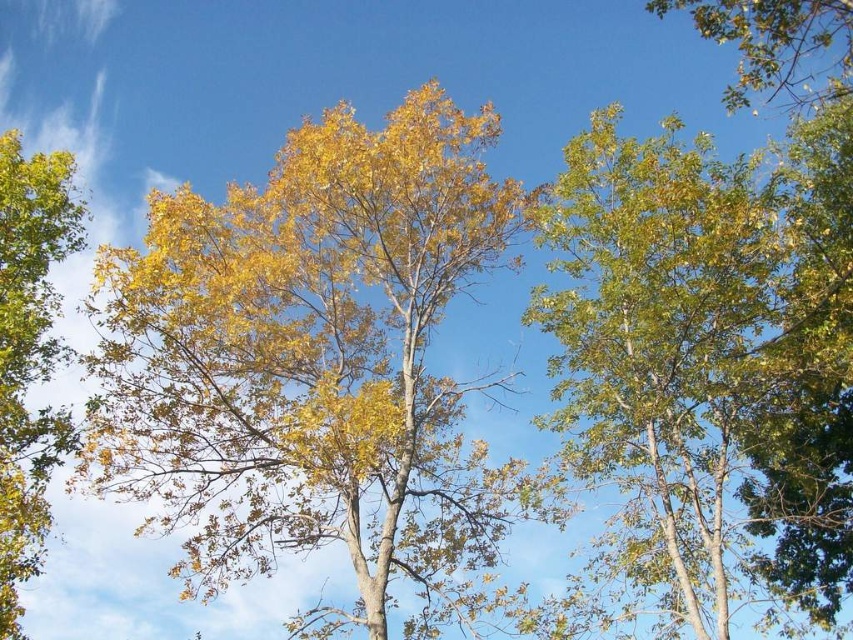
Question: Which point appears farthest from the camera in this image?

Choices:
 (A) (219, 269)
 (B) (671, 316)

Answer: (A)

Question: Does yellow-green leaves at center appear under green matte tree at left?

Choices:
 (A) yes
 (B) no

Answer: (A)

Question: Which is farther from the green matte tree at upper right?

Choices:
 (A) yellow-green leaves at center
 (B) green matte tree at left

Answer: (B)

Question: Can you confirm if green matte tree at upper right is positioned to the right of green matte tree at left?

Choices:
 (A) yes
 (B) no

Answer: (A)

Question: Is green matte tree at upper right in front of green matte tree at left?

Choices:
 (A) yes
 (B) no

Answer: (B)

Question: Which object is positioned farthest from the green matte tree at left?

Choices:
 (A) green matte tree at upper right
 (B) yellow-green leaves at center

Answer: (A)